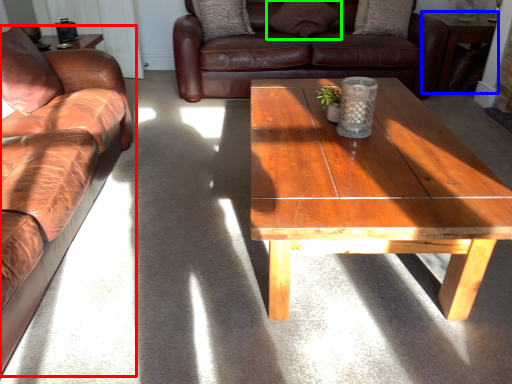
Question: Which object is the closest to the studio couch (highlighted by a red box)? Choose among these: table (highlighted by a blue box) or pillow (highlighted by a green box).

Choices:
 (A) table
 (B) pillow

Answer: (B)